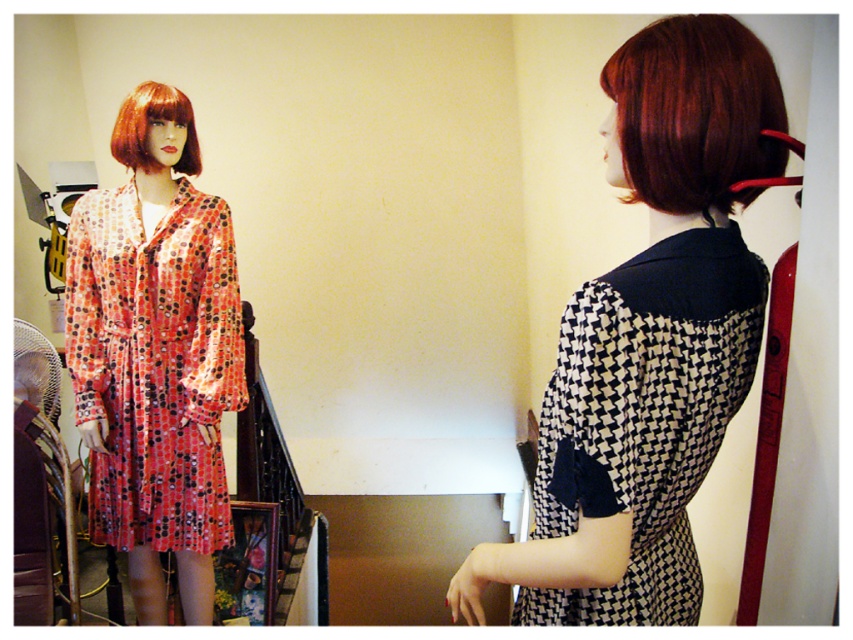
You are a customer in the store and want to know which dress is closer to the entrance. The entrance is located to the right side of the store. Based on the positioning of the black and white checkered dress at center and the shiny red hair at upper right, which dress is closer to the entrance?

The black and white checkered dress at center is positioned on the left side of shiny red hair at upper right. Since the entrance is on the right side of the store, the shiny red hair at upper right is closer to the entrance than the black and white checkered dress at center.